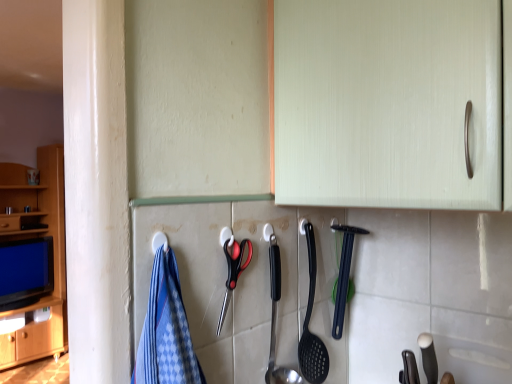
Question: From a real-world perspective, is satin silver spoon at center, arranged as the first silverware when viewed from the front, positioned above or below black plastic scissors at center?

Choices:
 (A) above
 (B) below

Answer: (B)

Question: Is point (269, 360) positioned closer to the camera than point (236, 248)?

Choices:
 (A) farther
 (B) closer

Answer: (A)

Question: Based on their relative distances, which object is farther from the black plastic spoon at center, positioned as the second silverware in front-to-back order?

Choices:
 (A) black plastic scissors at center
 (B) satin silver spoon at center, arranged as the first silverware when viewed from the front

Answer: (A)

Question: Which object is positioned closest to the satin silver spoon at center, positioned as the 2th silverware in back-to-front order?

Choices:
 (A) black plastic scissors at center
 (B) black plastic spoon at center, which ranks as the 1th silverware in right-to-left order

Answer: (A)